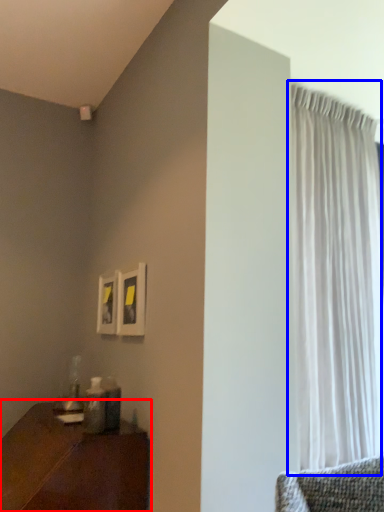
Question: Which object appears farthest to the camera in this image, table (highlighted by a red box) or curtain (highlighted by a blue box)?

Choices:
 (A) table
 (B) curtain

Answer: (B)